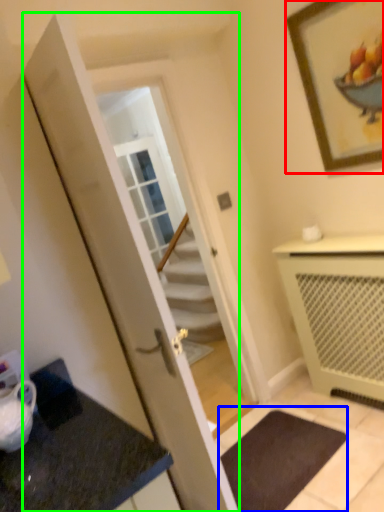
Question: Based on their relative distances, which object is nearer to picture frame (highlighted by a red box)? Choose from bath mat (highlighted by a blue box) and door (highlighted by a green box).

Choices:
 (A) bath mat
 (B) door

Answer: (B)